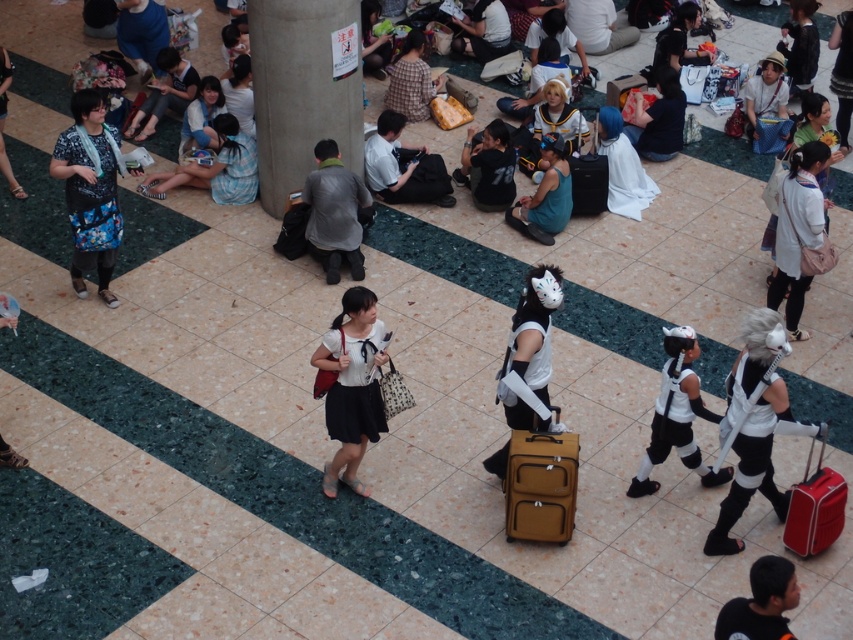
You are standing in the convention center and want to reach two points marked in the image. The first point is at coordinate point [405,161] and the second at point [374,36]. Which point is closer to you?

Point [405,161] is closer to the viewer than point [374,36].

You are standing at the center of the image and want to move towards the point marked at coordinates [486,168]. What object will you be moving towards?

The point at coordinates [486,168] is located on the black matte shirt at center, so moving towards that point means you are heading toward the black matte shirt at center.

You are a delivery person carrying a package that is 3 meters long. You need to move from the black matte shirt at center to the white plush toy at center. Is there enough space to move the package without bending it?

The distance between the black matte shirt at center and the white plush toy at center is 2.99 meters. Since the package is 3 meters long, it is slightly longer than the available space. Therefore, you cannot move the package without bending it.